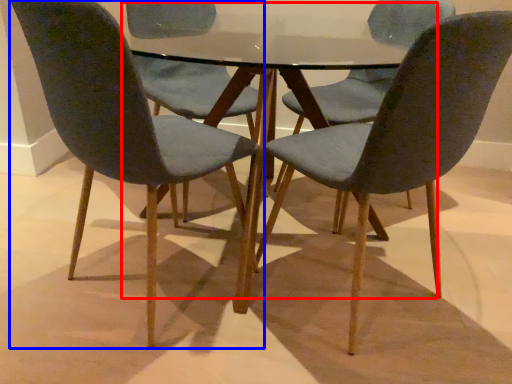
Question: Among these objects, which one is farthest to the camera, round table (highlighted by a red box) or chair (highlighted by a blue box)?

Choices:
 (A) round table
 (B) chair

Answer: (A)